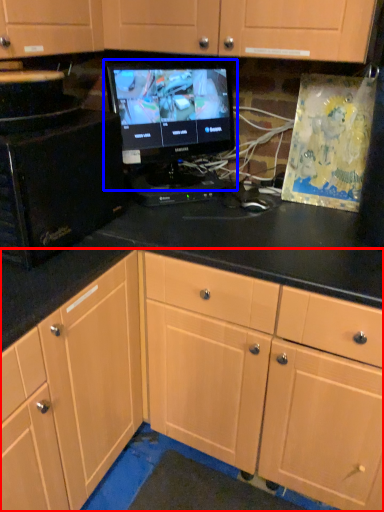
Question: Which object appears closest to the camera in this image, cabinetry (highlighted by a red box) or computer monitor (highlighted by a blue box)?

Choices:
 (A) cabinetry
 (B) computer monitor

Answer: (A)